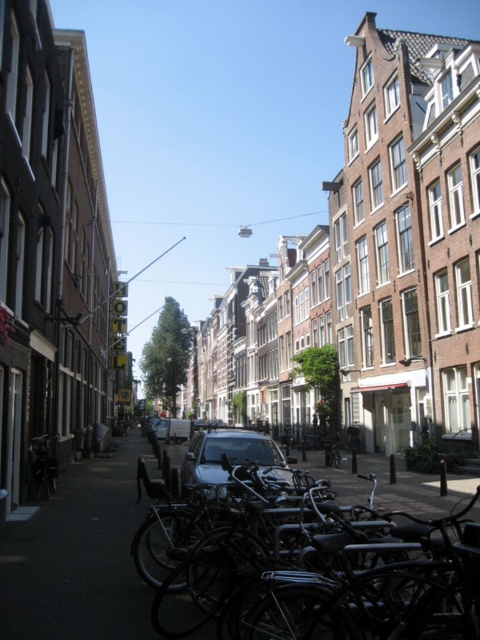
You are a tourist in Amsterdam and want to park your shiny black bicycle at lower left near the hotel sign. The hotel is on the left side of the street. Which direction should you move your bicycle to align it with the black matte bicycle at lower center?

Move the shiny black bicycle at lower left to the right to align it with the black matte bicycle at lower center, as the black matte bicycle at lower center is already positioned to the right of the shiny black bicycle at lower left.

You are a tourist in Amsterdam and want to take a photo of the shiny black car at center and the shiny black bicycle at lower left. Which object should you focus on first if you want to capture both in the same frame without moving your camera?

You should focus on the shiny black bicycle at lower left first because the shiny black car at center is below it, so adjusting the camera angle to include both would require framing from the top down.